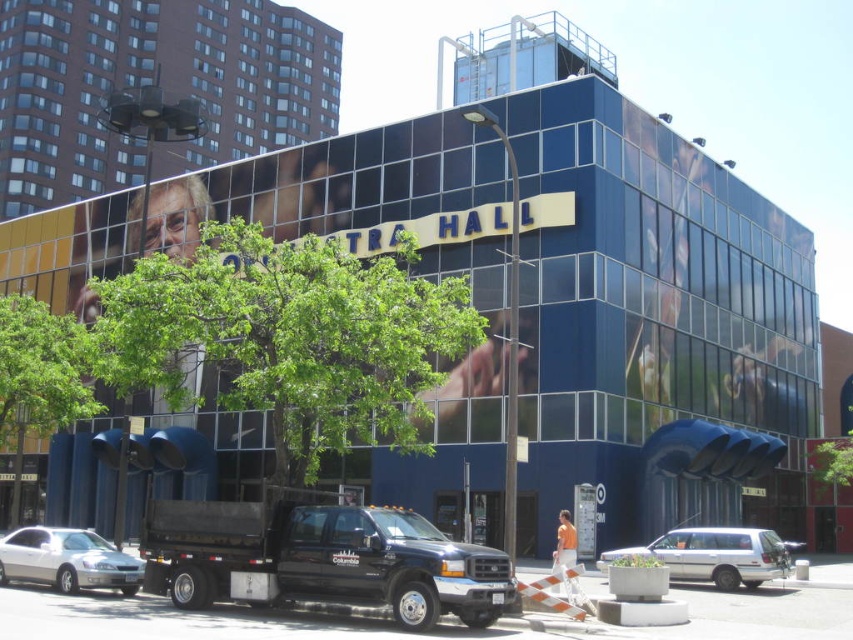
Is green leafy tree at lower left closer to the viewer compared to white matte minivan at lower right?

That is False.

Is green leafy tree at lower left shorter than white matte minivan at lower right?

No, green leafy tree at lower left is not shorter than white matte minivan at lower right.

Locate an element on the screen. Image resolution: width=853 pixels, height=640 pixels. green leafy tree at lower left is located at coordinates (39, 376).

Is green leafy tree at center to the right of green leafy tree at lower left from the viewer's perspective?

Yes, green leafy tree at center is to the right of green leafy tree at lower left.

The width and height of the screenshot is (853, 640). In order to click on green leafy tree at center in this screenshot , I will do `click(289, 337)`.

Between green leafy tree at center and silver metallic sedan at lower left, which one is positioned lower?

Positioned lower is silver metallic sedan at lower left.

Describe the element at coordinates (289, 337) in the screenshot. The height and width of the screenshot is (640, 853). I see `green leafy tree at center` at that location.

Image resolution: width=853 pixels, height=640 pixels. Identify the location of green leafy tree at center. (289, 337).